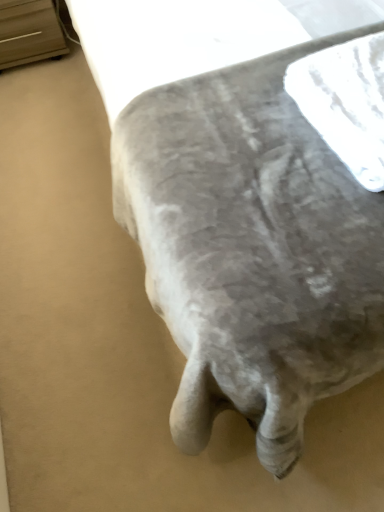
What are the coordinates of `vacant area that is in front of matte wood dresser at upper left` in the screenshot? It's located at (42, 89).